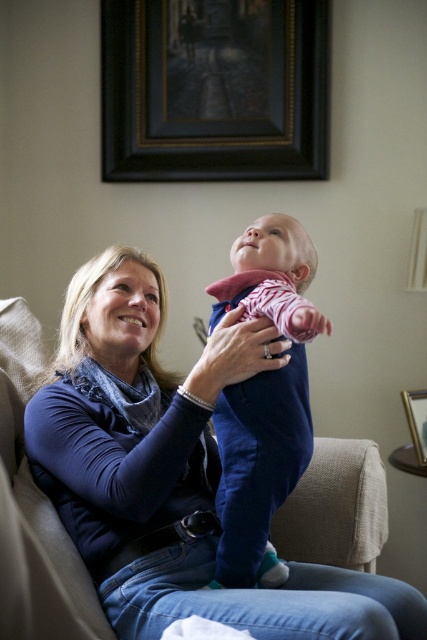
Question: Which is farther from the black wood picture frame at upper center?

Choices:
 (A) blue fleece sweater at upper left
 (B) velvet blue onesie at center

Answer: (A)

Question: Which object is farther from the camera taking this photo?

Choices:
 (A) wooden picture frame at upper right
 (B) blue fleece sweater at upper left

Answer: (A)

Question: Among these objects, which one is nearest to the camera?

Choices:
 (A) black wood picture frame at upper center
 (B) blue fleece sweater at upper left

Answer: (B)

Question: Is blue fleece sweater at upper left to the left of velvet blue onesie at center from the viewer's perspective?

Choices:
 (A) yes
 (B) no

Answer: (A)

Question: Can you confirm if blue fleece sweater at upper left is thinner than wooden picture frame at upper right?

Choices:
 (A) yes
 (B) no

Answer: (B)

Question: Where is blue fleece sweater at upper left located in relation to wooden picture frame at upper right in the image?

Choices:
 (A) above
 (B) below

Answer: (A)